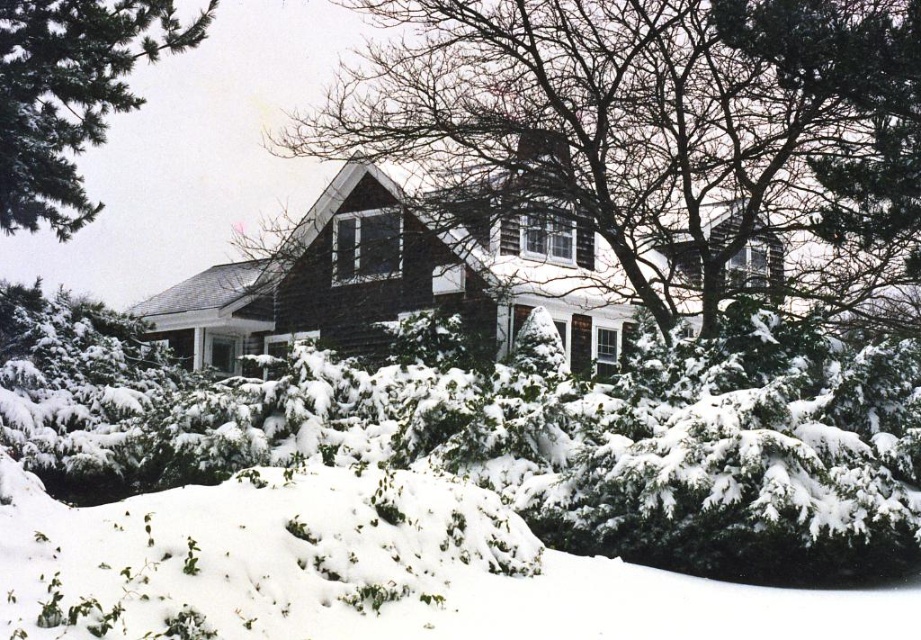
Which of these two, bare branches at center or green needle-like at upper left, stands shorter?

green needle-like at upper left

Consider the image. Does bare branches at center appear on the right side of green needle-like at upper left?

Correct, you'll find bare branches at center to the right of green needle-like at upper left.

Between point (825, 17) and point (56, 17), which one is positioned in front?

Point (825, 17)

Where is `bare branches at center`? bare branches at center is located at coordinates (654, 129).

Can you confirm if white fluffy snow at lower center is positioned below green needle-like at upper left?

Correct, white fluffy snow at lower center is located below green needle-like at upper left.

Is white fluffy snow at lower center positioned before green needle-like at upper left?

Yes, it is in front of green needle-like at upper left.

Does point (115, 579) come farther from viewer compared to point (14, 131)?

That is False.

You are a GUI agent. You are given a task and a screenshot of the screen. Output one action in this format:
    pyautogui.click(x=<x>, y=<y>)
    Task: Click on the white fluffy snow at lower center
    Image resolution: width=921 pixels, height=640 pixels.
    Given the screenshot: What is the action you would take?
    pyautogui.click(x=383, y=573)

Which is below, bare branches at center or white fluffy snow at lower center?

Positioned lower is white fluffy snow at lower center.

Which is above, bare branches at center or white fluffy snow at lower center?

bare branches at center is above.

The height and width of the screenshot is (640, 921). What do you see at coordinates (654, 129) in the screenshot?
I see `bare branches at center` at bounding box center [654, 129].

This screenshot has height=640, width=921. What are the coordinates of `bare branches at center` in the screenshot? It's located at (654, 129).